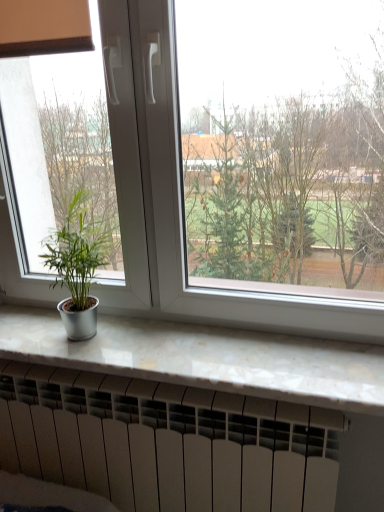
The width and height of the screenshot is (384, 512). I want to click on green matte plant at left, so click(x=77, y=266).

Based on the photo, what is the approximate width of white plastic window at center?

The width of white plastic window at center is 11.13 centimeters.

Identify the location of green matte plant at left. The height and width of the screenshot is (512, 384). (77, 266).

Measure the distance from white plastic window at center to white marble counter top at lower center.

They are 8.94 inches apart.

Is point (103, 12) positioned behind point (349, 381)?

Yes, it is.

Consider the image. Can you confirm if white plastic window at center is smaller than white marble counter top at lower center?

Incorrect, white plastic window at center is not smaller in size than white marble counter top at lower center.

Can you confirm if white plastic window at center is positioned to the right of white marble counter top at lower center?

Indeed, white plastic window at center is positioned on the right side of white marble counter top at lower center.

How distant is white matte heater at bottom from white marble counter top at lower center?

white matte heater at bottom and white marble counter top at lower center are 9.36 inches apart.

From the image's perspective, is white matte heater at bottom over white marble counter top at lower center?

Actually, white matte heater at bottom appears below white marble counter top at lower center in the image.

You are a GUI agent. You are given a task and a screenshot of the screen. Output one action in this format:
    pyautogui.click(x=<x>, y=<y>)
    Task: Click on the counter top that appears in front of the white matte heater at bottom
    The image size is (384, 512).
    Given the screenshot: What is the action you would take?
    pyautogui.click(x=206, y=358)

Who is more distant, white matte heater at bottom or white marble counter top at lower center?

white matte heater at bottom is further from the camera.

Is green matte plant at left wider or thinner than white plastic window at center?

green matte plant at left is wider than white plastic window at center.

Does green matte plant at left have a larger size compared to white plastic window at center?

Incorrect, green matte plant at left is not larger than white plastic window at center.

Is green matte plant at left facing away from white plastic window at center?

Yes, green matte plant at left is positioned with its back facing white plastic window at center.

Which object is thinner, white plastic window at center or white matte heater at bottom?

white matte heater at bottom.

Is white plastic window at center bigger than white matte heater at bottom?

Yes.

Does point (143, 221) appear closer or farther from the camera than point (240, 475)?

Point (143, 221).

Which is in front, white plastic window at center or white matte heater at bottom?

white plastic window at center is closer to the camera.

Considering the relative positions of white marble counter top at lower center and white plastic window at center in the image provided, is white marble counter top at lower center to the right of white plastic window at center from the viewer's perspective?

In fact, white marble counter top at lower center is to the left of white plastic window at center.

Does point (221, 345) come closer to viewer compared to point (14, 219)?

Yes, it is.

Does white marble counter top at lower center have a greater width compared to white plastic window at center?

Indeed, white marble counter top at lower center has a greater width compared to white plastic window at center.

Which object is more forward, white marble counter top at lower center or white plastic window at center?

white plastic window at center.

Who is shorter, green matte plant at left or white marble counter top at lower center?

white marble counter top at lower center is shorter.

Is green matte plant at left not close to white marble counter top at lower center?

No, green matte plant at left is in close proximity to white marble counter top at lower center.

Is green matte plant at left at the left side of white marble counter top at lower center?

Indeed, green matte plant at left is positioned on the left side of white marble counter top at lower center.

Do you think white matte heater at bottom is within green matte plant at left, or outside of it?

white matte heater at bottom is spatially situated outside green matte plant at left.

From the image's perspective, is white matte heater at bottom above or below green matte plant at left?

From the image's perspective, white matte heater at bottom appears below green matte plant at left.

At what (x,y) coordinates should I click in order to perform the action: click on houseplant above the white matte heater at bottom (from a real-world perspective). Please return your answer as a coordinate pair (x, y). Looking at the image, I should click on (77, 266).

Considering the relative positions of white matte heater at bottom and green matte plant at left in the image provided, is white matte heater at bottom in front of green matte plant at left?

No, white matte heater at bottom is behind green matte plant at left.

There is a white marble counter top at lower center. Where is `window above it (from a real-world perspective)`? This screenshot has width=384, height=512. window above it (from a real-world perspective) is located at coordinates click(180, 205).

Identify the location of counter top on the right of the white matte heater at bottom. The height and width of the screenshot is (512, 384). (206, 358).

Estimate the real-world distances between objects in this image. Which object is further from white marble counter top at lower center, green matte plant at left or white plastic window at center?

Based on the image, green matte plant at left appears to be further to white marble counter top at lower center.

Looking at the image, which one is located closer to green matte plant at left, white marble counter top at lower center or white matte heater at bottom?

Among the two, white marble counter top at lower center is located nearer to green matte plant at left.

Looking at the image, which one is located closer to white plastic window at center, white matte heater at bottom or white marble counter top at lower center?

white marble counter top at lower center.

From the image, which object appears to be farther from white plastic window at center, green matte plant at left or white marble counter top at lower center?

white marble counter top at lower center.

From the image, which object appears to be farther from white marble counter top at lower center, white plastic window at center or white matte heater at bottom?

white matte heater at bottom.

Consider the image. Which object lies further to the anchor point white matte heater at bottom, white marble counter top at lower center or white plastic window at center?

Based on the image, white plastic window at center appears to be further to white matte heater at bottom.

Looking at the image, which one is located further to white matte heater at bottom, white marble counter top at lower center or green matte plant at left?

The object further to white matte heater at bottom is green matte plant at left.

When comparing their distances from white plastic window at center, does white marble counter top at lower center or white matte heater at bottom seem further?

white matte heater at bottom is positioned further to the anchor white plastic window at center.

You are a GUI agent. You are given a task and a screenshot of the screen. Output one action in this format:
    pyautogui.click(x=<x>, y=<y>)
    Task: Click on the houseplant that lies between white plastic window at center and white marble counter top at lower center from top to bottom
    This screenshot has width=384, height=512.
    Given the screenshot: What is the action you would take?
    pyautogui.click(x=77, y=266)

Where is `houseplant between white plastic window at center and white matte heater at bottom from top to bottom`? houseplant between white plastic window at center and white matte heater at bottom from top to bottom is located at coordinates (77, 266).

This screenshot has height=512, width=384. In order to click on counter top that lies between green matte plant at left and white matte heater at bottom from top to bottom in this screenshot , I will do `click(206, 358)`.

Identify the location of counter top between white plastic window at center and white matte heater at bottom from top to bottom. (206, 358).